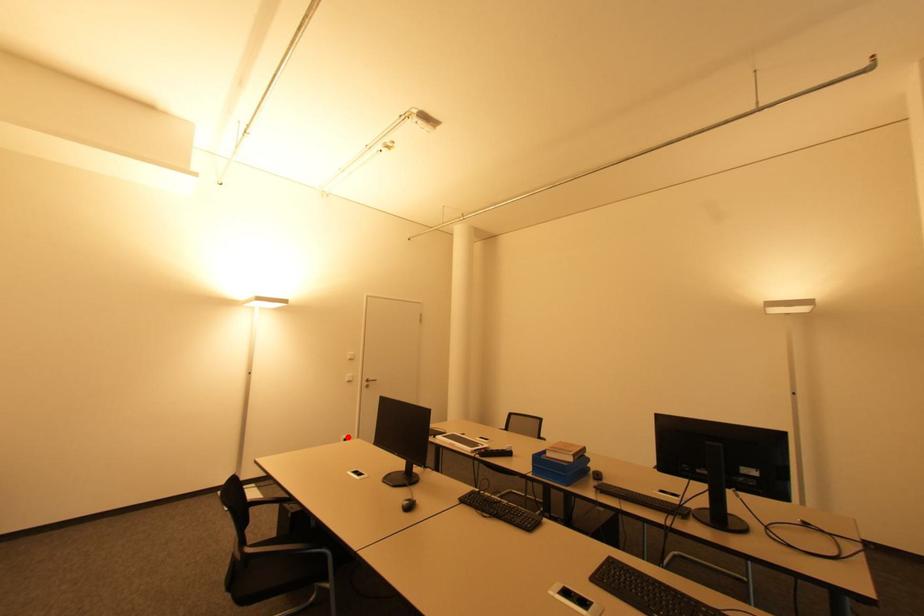
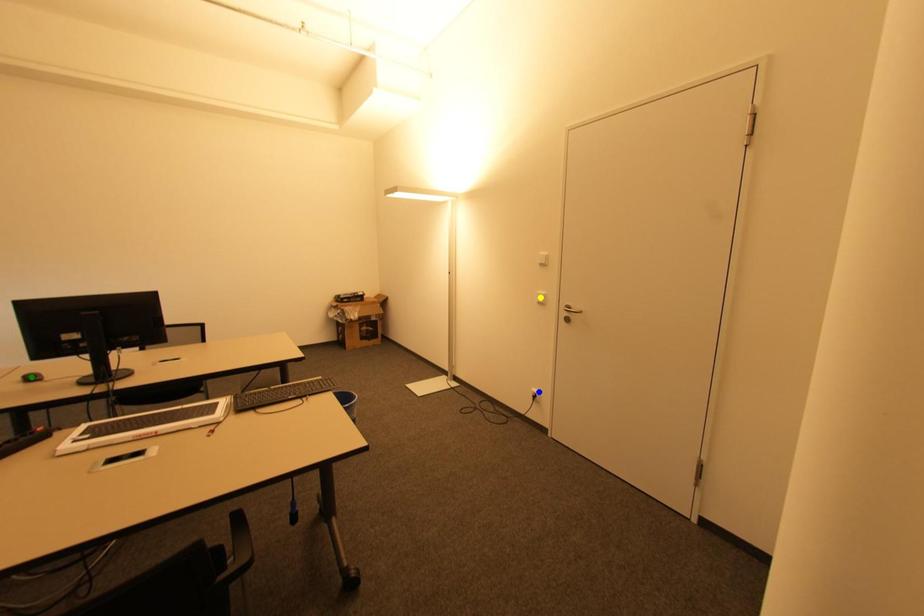
Question: I am providing you with two images of the same scene from different viewpoints. A red point is marked on the first image. You are given multiple points on the second image. Which point in image 2 represents the same 3d spot as the red point in image 1?

Choices:
 (A) blue point
 (B) yellow point
 (C) green point

Answer: (A)